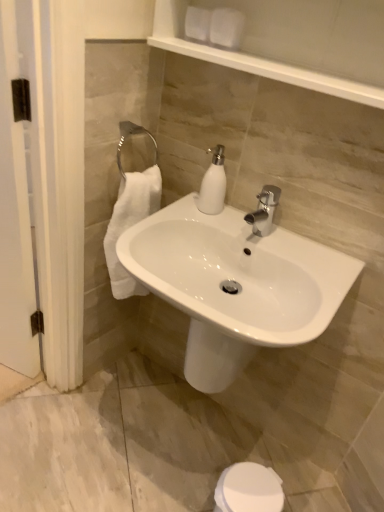
Where is `free region under white glossy sink at center (from a real-world perspective)`? This screenshot has width=384, height=512. free region under white glossy sink at center (from a real-world perspective) is located at coordinates (176, 439).